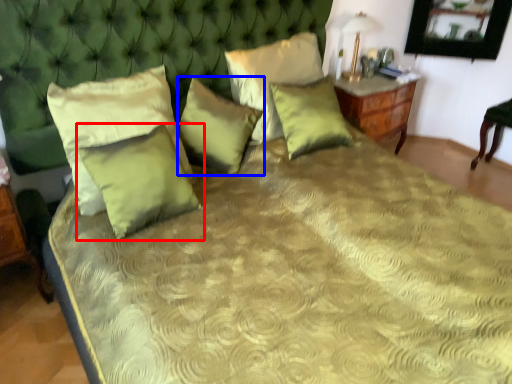
Question: Among these objects, which one is farthest to the camera, pillow (highlighted by a red box) or pillow (highlighted by a blue box)?

Choices:
 (A) pillow
 (B) pillow

Answer: (B)